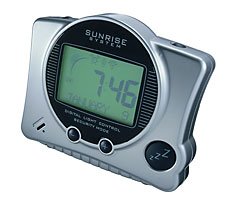
What are the coordinates of `snooze button` in the screenshot? It's located at [158, 159].